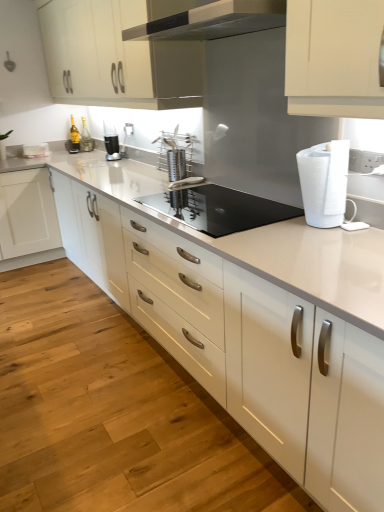
Question: Is white glossy countertop at center to the right of satin silver utensil holder at center, the second appliance from the front, from the viewer's perspective?

Choices:
 (A) no
 (B) yes

Answer: (A)

Question: From the image's perspective, would you say white glossy countertop at center is shown under satin silver utensil holder at center, the first appliance in the top-to-bottom sequence?

Choices:
 (A) yes
 (B) no

Answer: (A)

Question: Is white glossy countertop at center placed right next to satin silver utensil holder at center, the first appliance in the top-to-bottom sequence?

Choices:
 (A) yes
 (B) no

Answer: (B)

Question: Considering the relative sizes of white glossy countertop at center and satin silver utensil holder at center, marked as the first appliance in a back-to-front arrangement, in the image provided, is white glossy countertop at center wider than satin silver utensil holder at center, marked as the first appliance in a back-to-front arrangement,?

Choices:
 (A) no
 (B) yes

Answer: (B)

Question: Can you confirm if white glossy countertop at center is bigger than satin silver utensil holder at center, marked as the first appliance in a back-to-front arrangement?

Choices:
 (A) yes
 (B) no

Answer: (A)

Question: From the image's perspective, is white glossy countertop at center positioned above or below black glass cooktop at center, the second appliance from the back?

Choices:
 (A) above
 (B) below

Answer: (B)

Question: Is point (302, 359) closer or farther from the camera than point (167, 203)?

Choices:
 (A) closer
 (B) farther

Answer: (A)

Question: Relative to black glass cooktop at center, which is the 2th appliance in top-to-bottom order, is white glossy countertop at center in front or behind?

Choices:
 (A) front
 (B) behind

Answer: (A)

Question: Is white glossy countertop at center bigger or smaller than black glass cooktop at center, the 1th appliance from the front?

Choices:
 (A) big
 (B) small

Answer: (A)

Question: From their relative heights in the image, would you say black plastic blender at center is taller or shorter than white glossy countertop at center?

Choices:
 (A) tall
 (B) short

Answer: (B)

Question: Visually, is black plastic blender at center positioned to the left or to the right of white glossy countertop at center?

Choices:
 (A) left
 (B) right

Answer: (A)

Question: From the image's perspective, relative to white glossy countertop at center, is black plastic blender at center above or below?

Choices:
 (A) above
 (B) below

Answer: (A)

Question: From a real-world perspective, relative to white glossy countertop at center, is black plastic blender at center vertically above or below?

Choices:
 (A) below
 (B) above

Answer: (B)

Question: Is point (302, 192) positioned closer to the camera than point (352, 470)?

Choices:
 (A) farther
 (B) closer

Answer: (A)

Question: From a real-world perspective, is white plastic paper towel at right above or below white glossy countertop at center?

Choices:
 (A) above
 (B) below

Answer: (A)